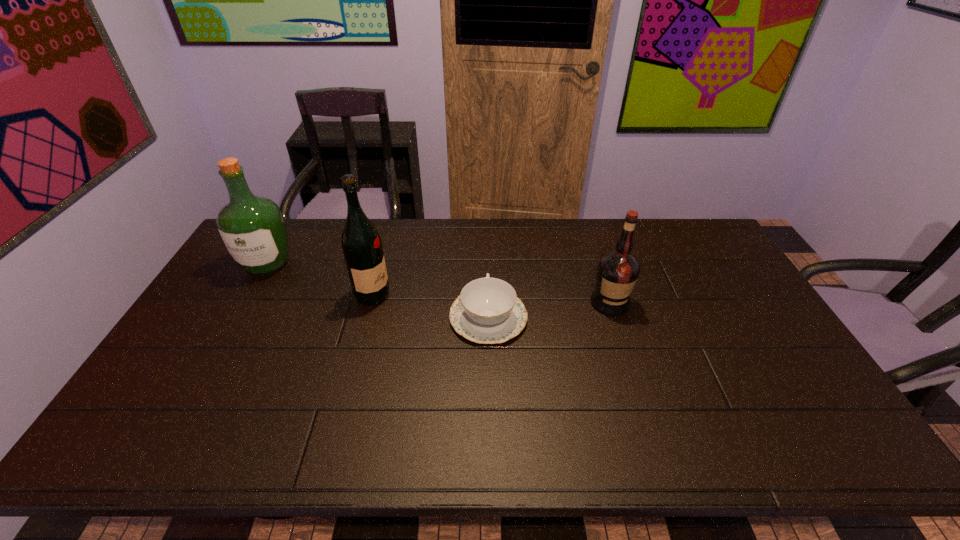
Identify the location of vacant space located 0.230m on the handle side of the second object from right to left. (487, 248).

Locate an element on the screen. The height and width of the screenshot is (540, 960). vacant space located on the handle side of the second object from right to left is located at coordinates (487, 246).

Where is `free location located on the handle side of the second object from right to left`? free location located on the handle side of the second object from right to left is located at coordinates (487, 259).

You are a GUI agent. You are given a task and a screenshot of the screen. Output one action in this format:
    pyautogui.click(x=<x>, y=<y>)
    Task: Click on the object that is at the far edge
    The width and height of the screenshot is (960, 540).
    Given the screenshot: What is the action you would take?
    pyautogui.click(x=252, y=227)

The width and height of the screenshot is (960, 540). Identify the location of object located at the left edge. (252, 227).

Find the location of a particular element. object that is positioned at the far left corner is located at coordinates (252, 227).

Image resolution: width=960 pixels, height=540 pixels. In the image, there is a desktop. What are the coordinates of `vacant area at the far edge` in the screenshot? It's located at (574, 242).

At what (x,y) coordinates should I click in order to perform the action: click on free space at the near edge of the desktop. Please return your answer as a coordinate pair (x, y). The image size is (960, 540). Looking at the image, I should click on (214, 452).

In the image, there is a desktop. Where is `blank space at the left edge`? blank space at the left edge is located at coordinates (179, 404).

The width and height of the screenshot is (960, 540). Find the location of `vacant area at the right edge`. vacant area at the right edge is located at coordinates (777, 408).